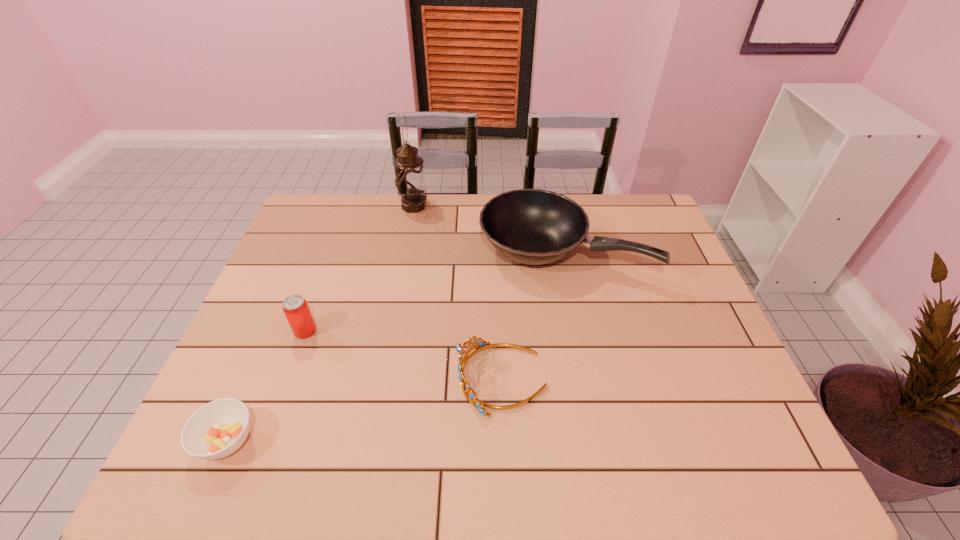
The height and width of the screenshot is (540, 960). I want to click on the farthest object, so click(x=410, y=181).

You are a GUI agent. You are given a task and a screenshot of the screen. Output one action in this format:
    pyautogui.click(x=<x>, y=<y>)
    Task: Click on the third object from left to right
    The height and width of the screenshot is (540, 960).
    Given the screenshot: What is the action you would take?
    pos(410,181)

The width and height of the screenshot is (960, 540). I want to click on frying pan, so click(530, 226).

Locate an element on the screen. The image size is (960, 540). tiara is located at coordinates (463, 355).

Locate an element on the screen. can is located at coordinates (295, 307).

Identify the location of the shortest object. click(x=216, y=430).

Where is `vacant space situated 0.360m on the front of the tallest object`? vacant space situated 0.360m on the front of the tallest object is located at coordinates (397, 291).

I want to click on vacant space located 0.280m on the left of the second farthest object, so click(x=390, y=251).

What are the coordinates of `vacant space located 0.160m on the front-facing side of the tiara` in the screenshot? It's located at pos(391,379).

I want to click on blank area located 0.380m on the front-facing side of the tiara, so click(x=298, y=379).